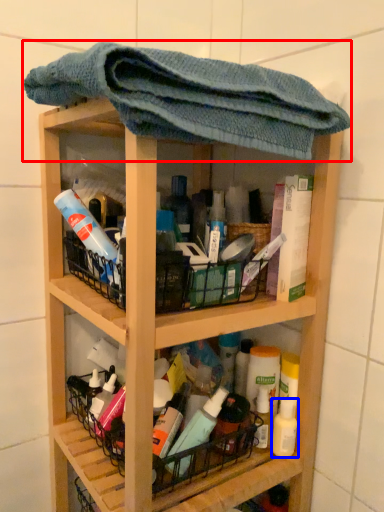
Question: Among these objects, which one is farthest to the camera, towel (highlighted by a red box) or mouthwash (highlighted by a blue box)?

Choices:
 (A) towel
 (B) mouthwash

Answer: (B)